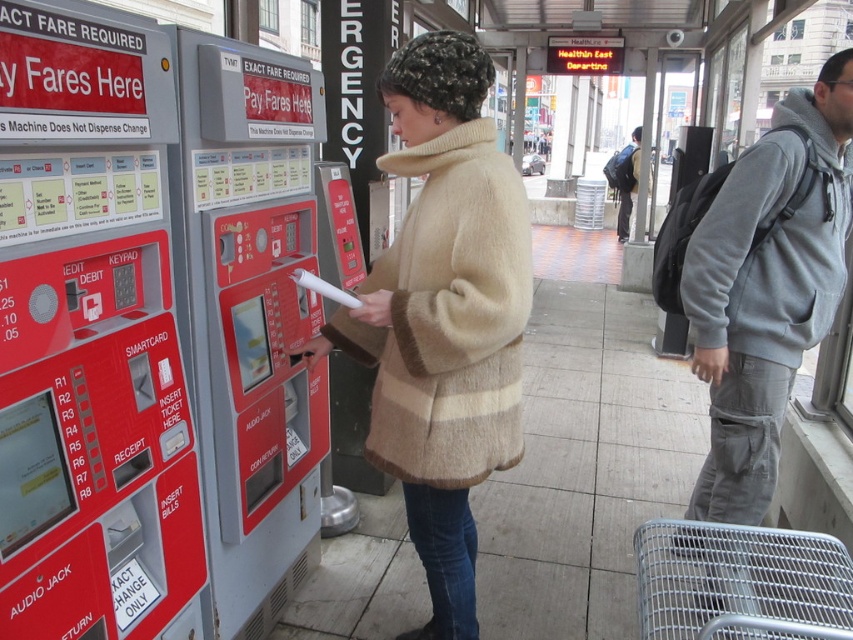
Between red plastic vending machine at left and dark gray backpack at right, which one has more height?

dark gray backpack at right is taller.

Is point (158, 173) in front of point (624, 186)?

Yes, point (158, 173) is closer to viewer.

At what (x,y) coordinates should I click in order to perform the action: click on red plastic vending machine at left. Please return your answer as a coordinate pair (x, y). This screenshot has width=853, height=640. Looking at the image, I should click on (90, 337).

Is red plastic vending machine at center bigger than beige fuzzy coat at center?

Incorrect, red plastic vending machine at center is not larger than beige fuzzy coat at center.

Between red plastic vending machine at center and beige fuzzy coat at center, which one is positioned lower?

Positioned lower is beige fuzzy coat at center.

Is point (183, 196) behind point (439, 593)?

No, it is not.

This screenshot has width=853, height=640. I want to click on red plastic vending machine at center, so point(248,316).

Between red plastic vending machine at center and gray fleece hoodie at right, which one appears on the right side from the viewer's perspective?

gray fleece hoodie at right is more to the right.

Can you confirm if red plastic vending machine at center is positioned to the right of gray fleece hoodie at right?

Incorrect, red plastic vending machine at center is not on the right side of gray fleece hoodie at right.

Is point (218, 481) positioned behind point (734, 330)?

No.

Where is `red plastic vending machine at center`? The width and height of the screenshot is (853, 640). red plastic vending machine at center is located at coordinates (248, 316).